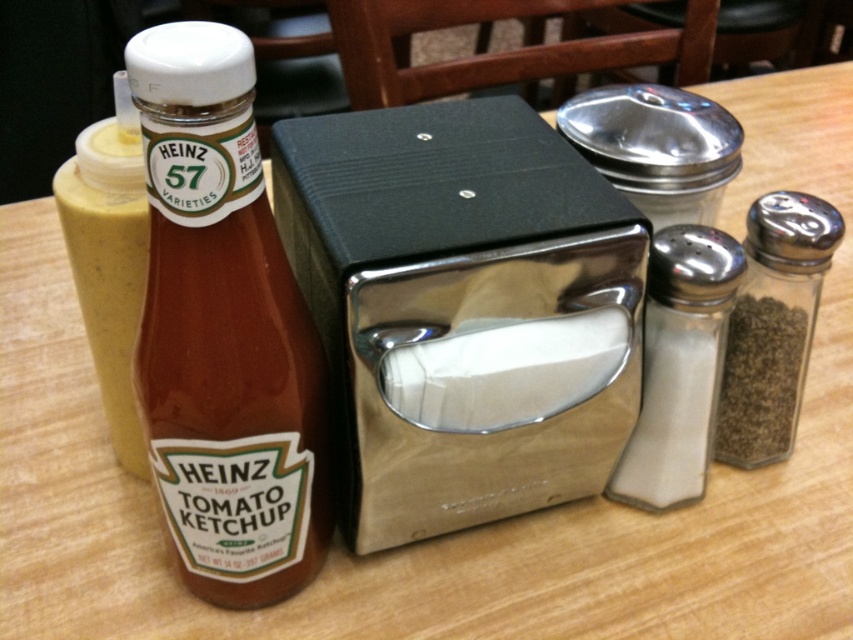
You are a waiter placing a new menu on the table. The menu needs to be placed between the matte glass bottle at left and the napkin dispenser to the right. Can you fit the menu there, and if so, where exactly should you place it?

The menu can be placed between the matte glass bottle at left and the napkin dispenser to the right since there is space between them. Position the menu centrally between the two objects to ensure it fits properly.

You are a diner customer who wants to season your meal with salt. You see the white glass salt shaker at right and the clear glass salt shaker at right. Which one is positioned lower on the table?

The white glass salt shaker at right is positioned below the clear glass salt shaker at right, so it is lower on the table.

You are a customer sitting at the table and want to reach for the napkin dispenser. There are two points marked on the table. Which point is closer to you, point (289, 467) or point (640, 429)?

Point (289, 467) is in front of point (640, 429), so it is closer to you.